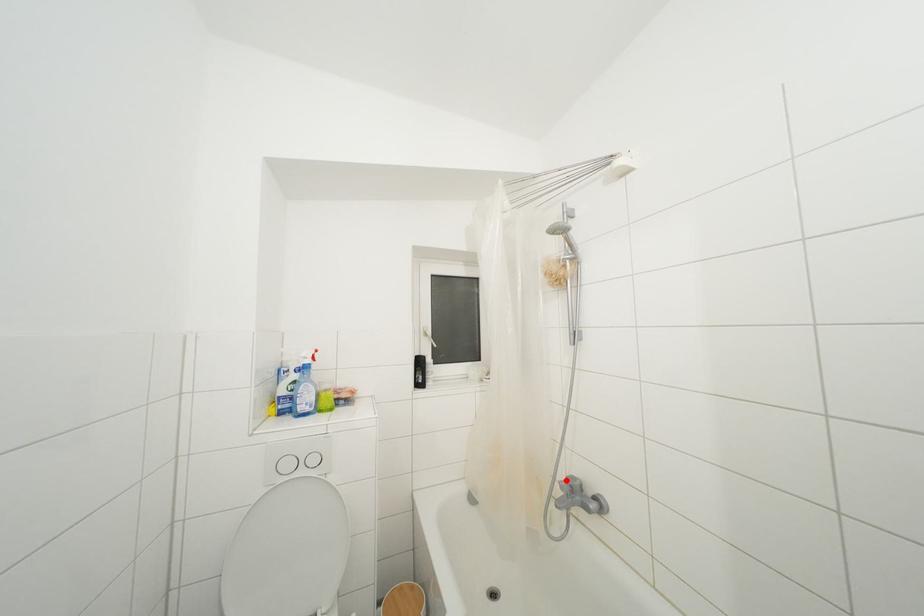
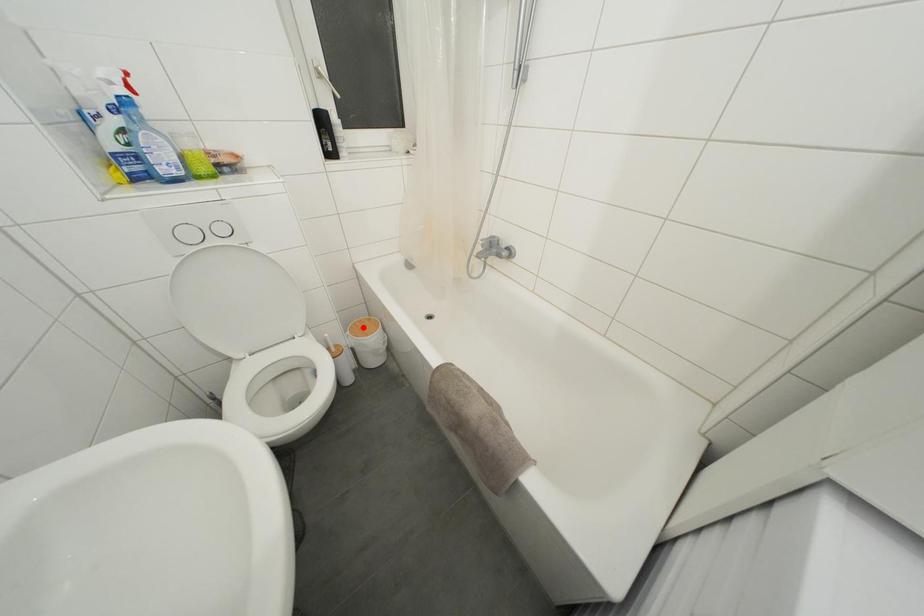
I am providing you with two images of the same scene from different viewpoints. A red point is marked on the first image and another point is marked on the second image. Is the marked point in image1 the same physical position as the marked point in image2?

No